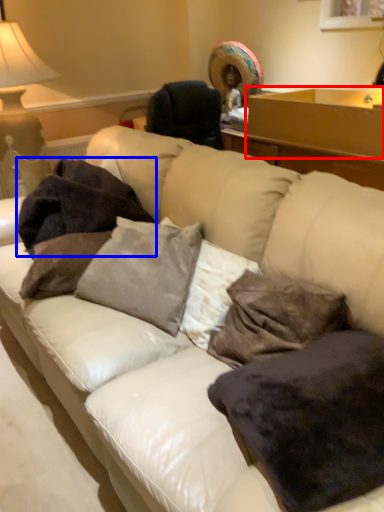
Question: Among these objects, which one is nearest to the camera, table (highlighted by a red box) or blanket (highlighted by a blue box)?

Choices:
 (A) table
 (B) blanket

Answer: (B)